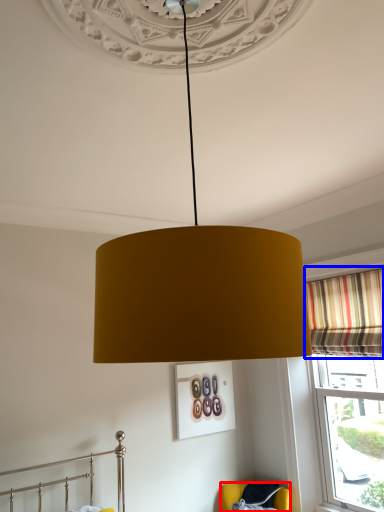
Question: Which point is closer to the camera, furniture (highlighted by a red box) or curtain (highlighted by a blue box)?

Choices:
 (A) furniture
 (B) curtain

Answer: (B)